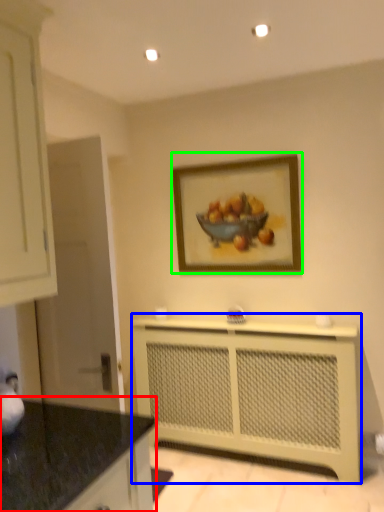
Question: Which object is positioned farthest from countertop (highlighted by a red box)? Select from counter (highlighted by a blue box) and picture frame (highlighted by a green box).

Choices:
 (A) counter
 (B) picture frame

Answer: (B)